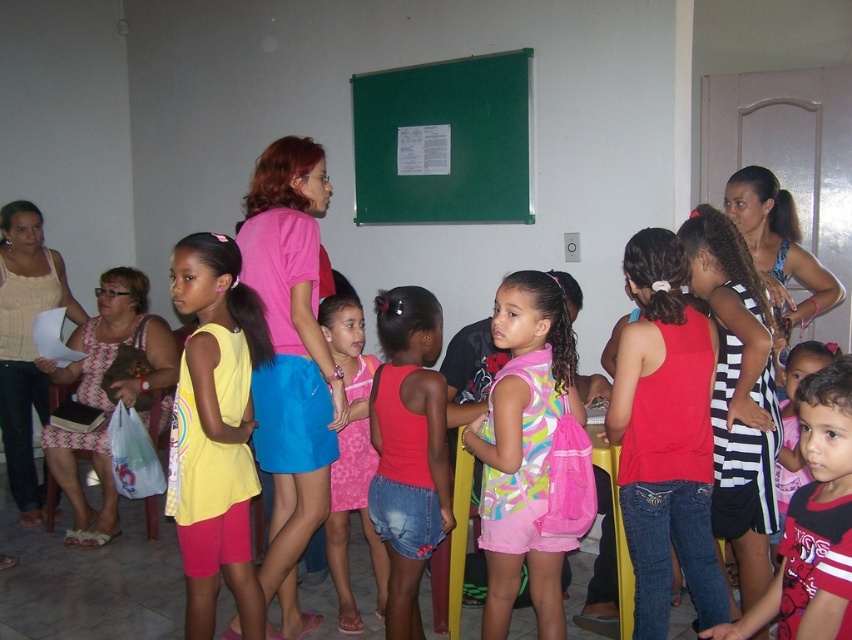
Question: Which point is closer to the camera?

Choices:
 (A) multicolored fabric backpack at center
 (B) pink denim shorts at center
 (C) yellow fabric shirt at center
 (D) pink lace dress at center

Answer: (A)

Question: Which is nearer to the pink matte skirt at center?

Choices:
 (A) yellow fabric shirt at center
 (B) pink lace dress at center
 (C) multicolored fabric backpack at center
 (D) striped cotton dress at lower right

Answer: (A)

Question: Which of the following is the closest to the observer?

Choices:
 (A) (68, 305)
 (B) (325, 532)
 (C) (798, 540)
 (D) (309, 371)

Answer: (C)

Question: From the image, what is the correct spatial relationship of pink matte skirt at center in relation to pink lace dress at center?

Choices:
 (A) right
 (B) left

Answer: (B)

Question: Does pink matte skirt at center have a smaller size compared to pink lace dress at center?

Choices:
 (A) no
 (B) yes

Answer: (A)

Question: Does multicolored fabric backpack at center appear on the right side of striped cotton dress at lower right?

Choices:
 (A) yes
 (B) no

Answer: (B)